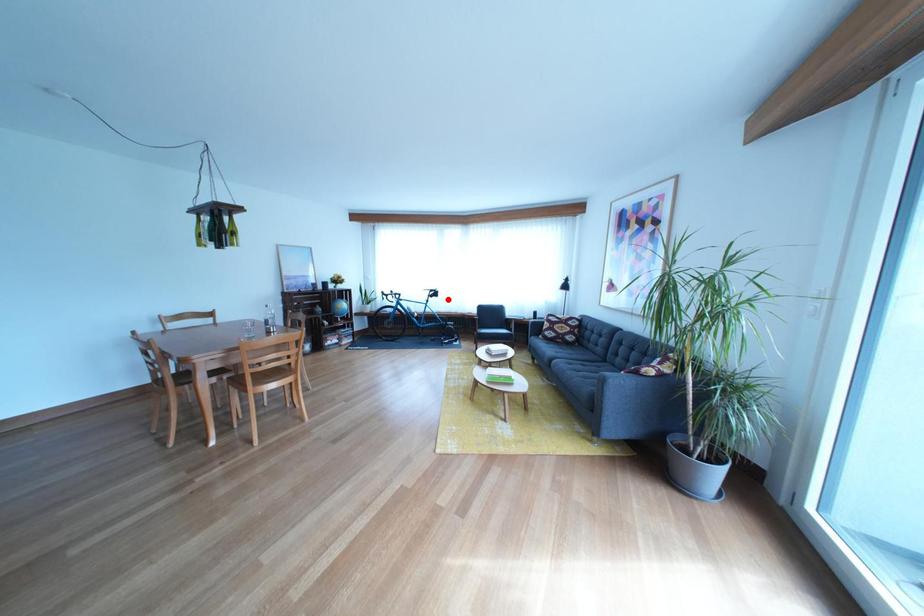
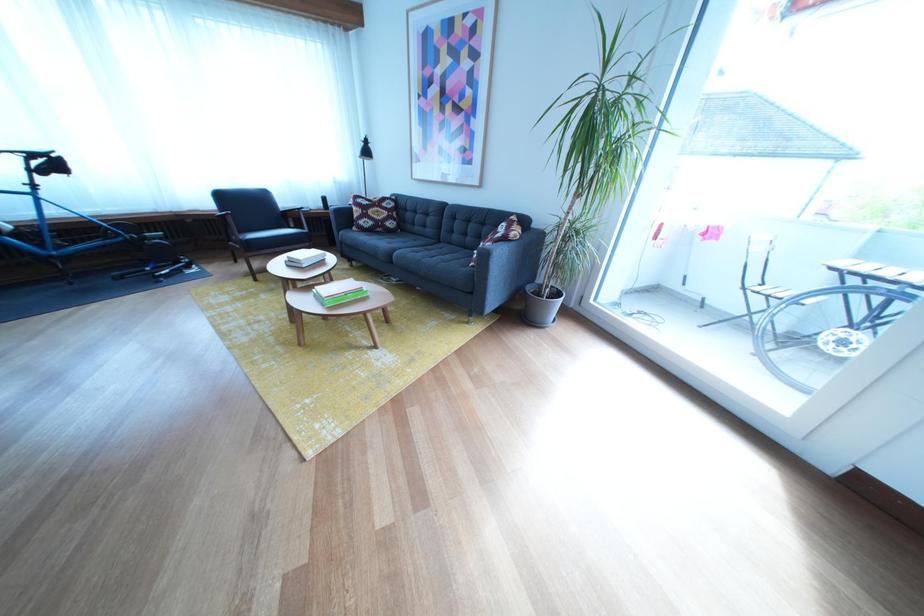
Question: A red point is marked in image1. In image2, is the corresponding 3D point closer to the camera or farther? Reply with the corresponding letter.

Choices:
 (A) The corresponding 3D point is closer.
 (B) The corresponding 3D point is farther.

Answer: (B)